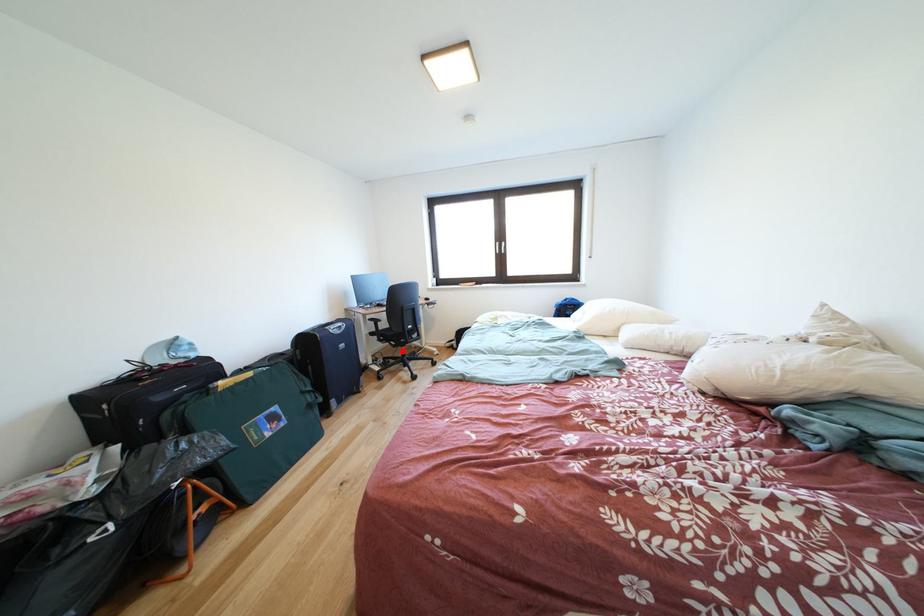
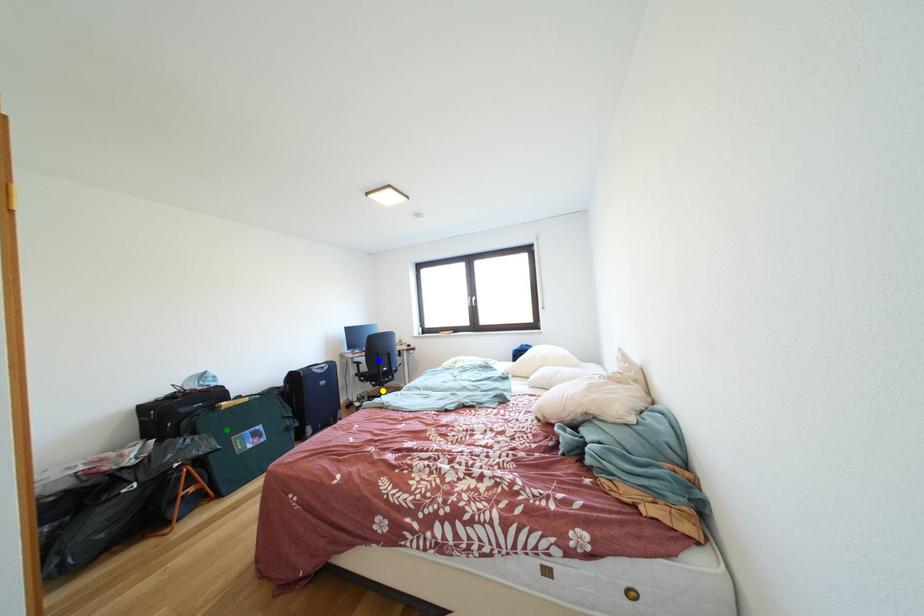
Question: I am providing you with two images of the same scene from different viewpoints. A red point is marked on the first image. You are given multiple points on the second image. In image 2, which mark is for the same physical point as the one in image 1?

Choices:
 (A) blue point
 (B) green point
 (C) yellow point

Answer: (C)